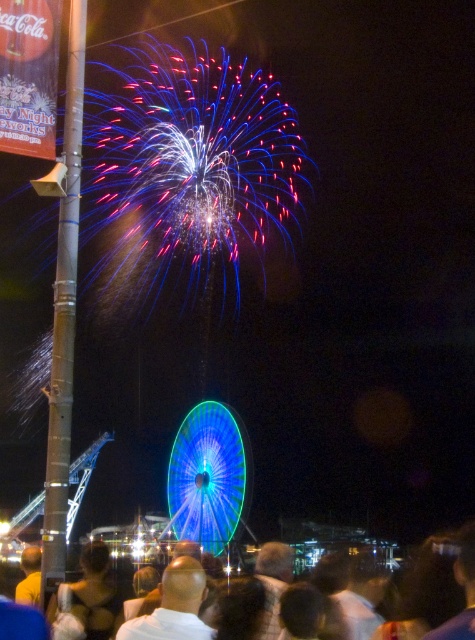
Between metallic pole at left and translucent blue ferris wheel at center, which one has less height?

With less height is translucent blue ferris wheel at center.

Does metallic pole at left have a greater height compared to translucent blue ferris wheel at center?

Indeed, metallic pole at left has a greater height compared to translucent blue ferris wheel at center.

Is point (75, 74) closer to viewer compared to point (199, 451)?

That is True.

Locate an element on the screen. This screenshot has width=475, height=640. metallic pole at left is located at coordinates (64, 316).

Who is taller, metallic pole at left or dark hair at lower center?

metallic pole at left

Is metallic pole at left shorter than dark hair at lower center?

No.

Who is more forward, (60,412) or (444,604)?

Point (60,412)

Identify the location of metallic pole at left. Image resolution: width=475 pixels, height=640 pixels. (64, 316).

Does point (207, 536) come closer to viewer compared to point (397, 609)?

No, (207, 536) is behind (397, 609).

Find the location of a particular element. Image resolution: width=475 pixels, height=640 pixels. translucent blue ferris wheel at center is located at coordinates (208, 476).